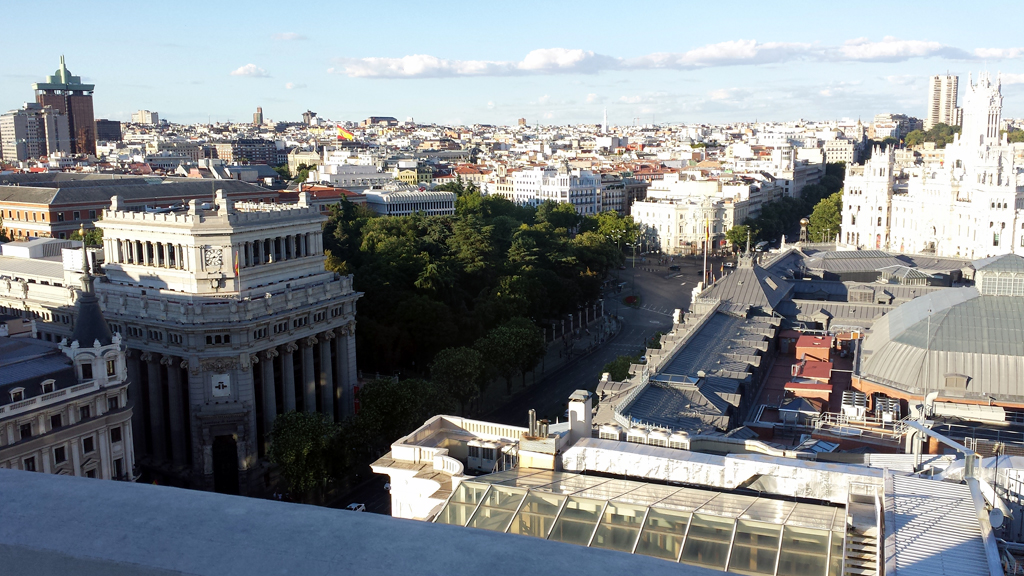
Where is `window`? The image size is (1024, 576). window is located at coordinates (545, 513).